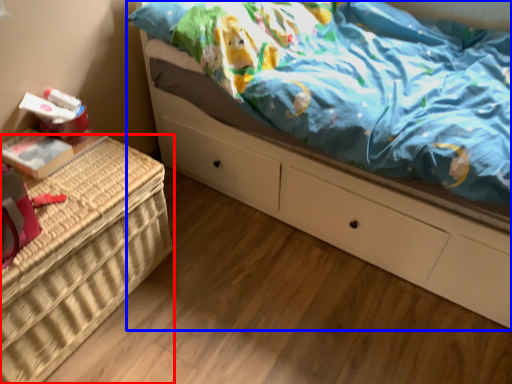
Question: Which point is further to the camera, furniture (highlighted by a red box) or bed (highlighted by a blue box)?

Choices:
 (A) furniture
 (B) bed

Answer: (A)